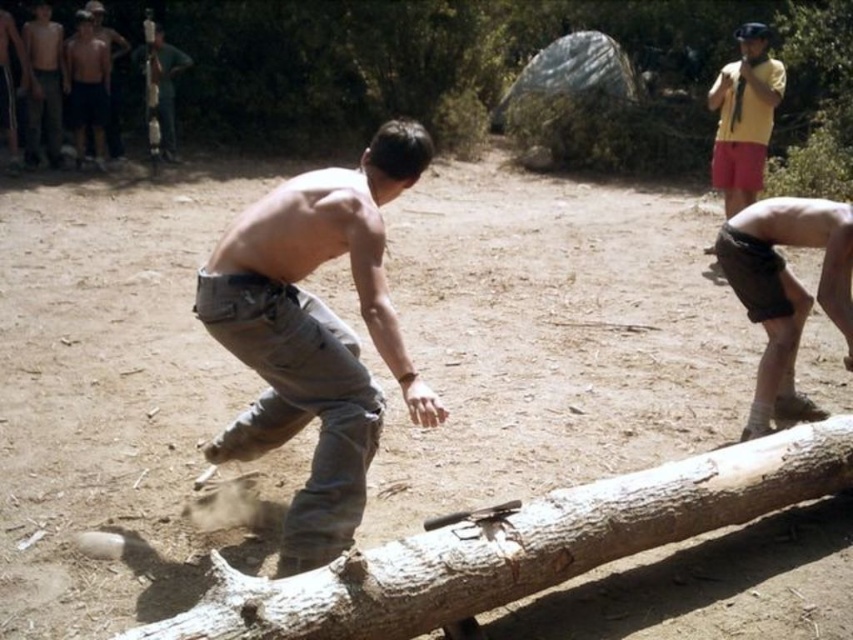
You are a photographer trying to capture the action of the man hitting the log. You have a camera with a wide angle lens that can focus on objects up to 1.5 meters tall. The black matte knee pad at lower right and the shiny metallic shirt at upper left are both in your frame. Which object should you focus on to ensure it fits within the camera lens height requirements?

The black matte knee pad at lower right is shorter than the shiny metallic shirt at upper left. Since the camera can focus on objects up to 1.5 meters tall, the black matte knee pad at lower right is more likely to fit within the height requirements.

You are a photographer observing the scene and want to capture the reflection of the shiny metallic shirt at upper left and the matte black shirt at upper left in the water below. Which shirt would have a more prominent reflection?

The shiny metallic shirt at upper left has a more prominent reflection because it is taller than the matte black shirt at upper left, making it more visible in the water.

You are a photographer setting up a tripod to capture the action between the shiny metallic shirt at upper left and the matte black shirt at upper left. The minimum distance your camera can focus clearly is 14 inches. Will the shirts be in focus if you position the tripod at this distance?

The shiny metallic shirt at upper left is 14.13 inches from matte black shirt at upper left. Since the minimum focus distance is 14 inches, the shirts are just slightly beyond the camera focus range. To ensure clarity, move the tripod closer or adjust the focus setting.